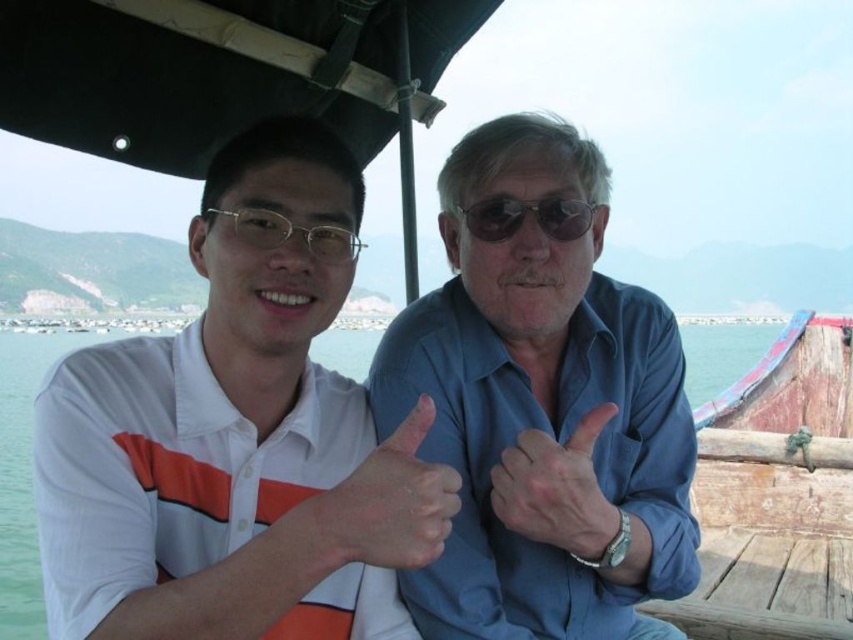
Question: Can you confirm if dry skin at center is positioned to the left of smooth skin hand at center?

Choices:
 (A) no
 (B) yes

Answer: (B)

Question: Considering the real-world distances, which object is closest to the blue cotton shirt at center?

Choices:
 (A) gold metallic glasses at center
 (B) sunglasses at center
 (C) white cotton shirt at center

Answer: (B)

Question: Can you confirm if blue cotton shirt at center is positioned above sunglasses at center?

Choices:
 (A) yes
 (B) no

Answer: (B)

Question: Which of the following is the closest to the observer?

Choices:
 (A) (547, 214)
 (B) (352, 540)
 (C) (325, 240)

Answer: (B)

Question: Which point is closer to the camera taking this photo?

Choices:
 (A) (630, 525)
 (B) (329, 257)
 (C) (488, 234)

Answer: (A)

Question: Is white cotton shirt at center to the left of sunglasses at center from the viewer's perspective?

Choices:
 (A) yes
 (B) no

Answer: (A)